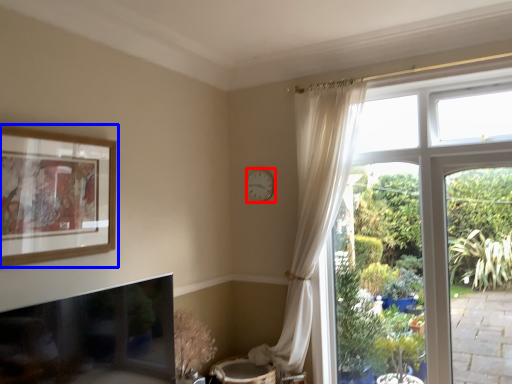
Question: Which of the following is the farthest to the observer, clock (highlighted by a red box) or picture frame (highlighted by a blue box)?

Choices:
 (A) clock
 (B) picture frame

Answer: (A)